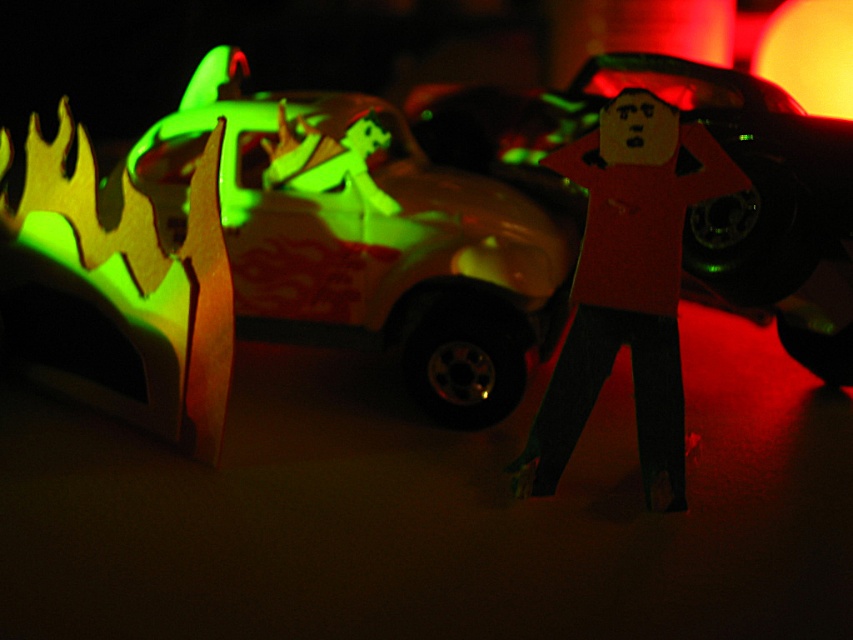
Question: Can you confirm if glowing plastic car at center is smaller than fluorescent yellow cardboard flames at left?

Choices:
 (A) yes
 (B) no

Answer: (B)

Question: Among these points, which one is farthest from the camera?

Choices:
 (A) (410, 154)
 (B) (27, 308)
 (C) (630, 200)

Answer: (A)

Question: Which point appears closest to the camera in this image?

Choices:
 (A) (608, 266)
 (B) (444, 364)

Answer: (A)

Question: From the image, what is the correct spatial relationship of fluorescent yellow cardboard flames at left in relation to cardboard figure at center?

Choices:
 (A) below
 (B) above

Answer: (B)

Question: Is glowing plastic car at center further to the viewer compared to fluorescent yellow cardboard flames at left?

Choices:
 (A) yes
 (B) no

Answer: (A)

Question: Which point is farther from the camera taking this photo?

Choices:
 (A) (178, 296)
 (B) (503, 260)
 (C) (598, 244)

Answer: (B)